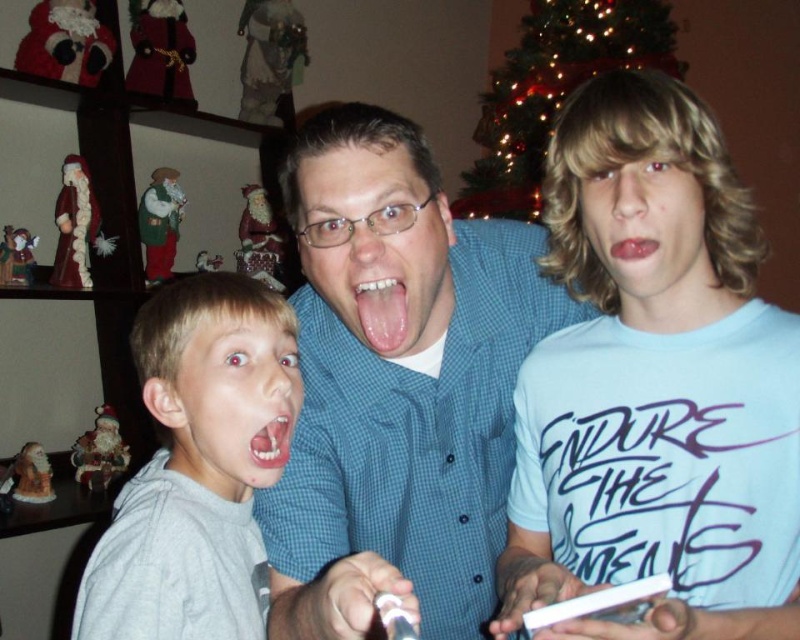
You are a photographer trying to capture a candid shot of the light blue cotton shirt at right and the gray matte hoodie at left. Since you want to focus on the shirt, which object should you position your camera closer to, and why?

You should position your camera closer to the light blue cotton shirt at right because it is above the gray matte hoodie at left, allowing for better focus on the shirt.

You are a photographer adjusting the camera focus. The shiny metallic ornament at upper center and the white glossy teeth at center are both in the frame. Which object should you focus on first if you want to ensure the larger one is sharp?

The shiny metallic ornament at upper center should be focused on first because it is larger than the white glossy teeth at center.